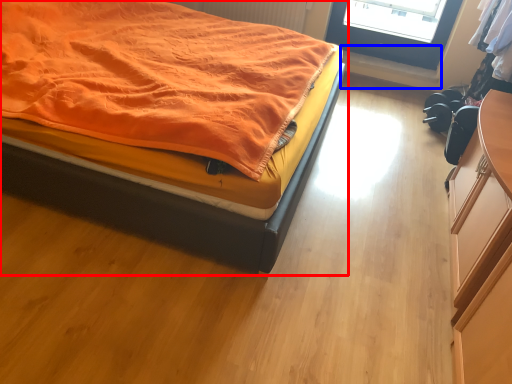
Question: Among these objects, which one is farthest to the camera, bed (highlighted by a red box) or window sill (highlighted by a blue box)?

Choices:
 (A) bed
 (B) window sill

Answer: (B)